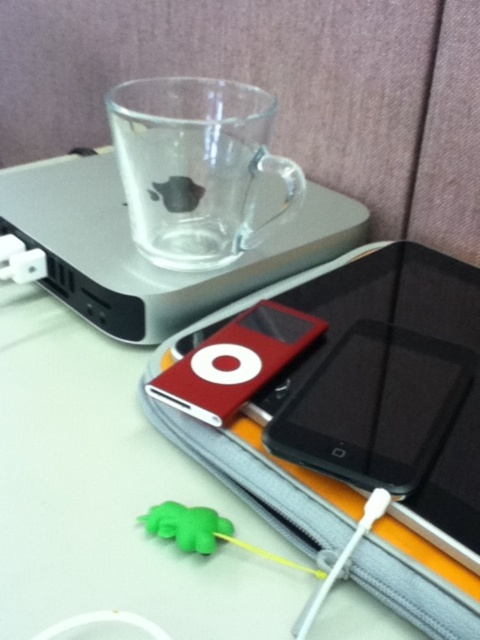
Based on the photo, can you confirm if transparent glass cup at upper center is wider than red matte/ipod at center?

Indeed, transparent glass cup at upper center has a greater width compared to red matte/ipod at center.

Based on the photo, does transparent glass cup at upper center have a smaller size compared to red matte/ipod at center?

No, transparent glass cup at upper center is not smaller than red matte/ipod at center.

Is point (181, 198) closer to viewer compared to point (278, 317)?

Yes, it is in front of point (278, 317).

This screenshot has width=480, height=640. What are the coordinates of `transparent glass cup at upper center` in the screenshot? It's located at (195, 168).

Can you confirm if transparent plastic ipod at center is smaller than black glossy iphone at center?

Actually, transparent plastic ipod at center might be larger than black glossy iphone at center.

Is transparent plastic ipod at center thinner than black glossy iphone at center?

In fact, transparent plastic ipod at center might be wider than black glossy iphone at center.

Find the location of a particular element. transparent plastic ipod at center is located at coordinates (141, 256).

The height and width of the screenshot is (640, 480). Find the location of `transparent plastic ipod at center`. transparent plastic ipod at center is located at coordinates (141, 256).

Is transparent plastic ipod at center taller than transparent glass cup at upper center?

Yes.

Which is in front, point (339, 253) or point (240, 186)?

Point (240, 186) is in front.

Who is more forward, (116, 212) or (238, 168)?

Point (238, 168) is in front.

The height and width of the screenshot is (640, 480). In order to click on transparent plastic ipod at center in this screenshot , I will do `click(141, 256)`.